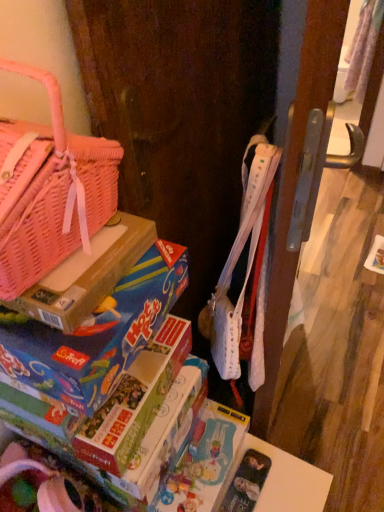
Question: From a real-world perspective, is pink woven basket at upper left over matte cardboard book at lower left?

Choices:
 (A) yes
 (B) no

Answer: (A)

Question: Is pink woven basket at upper left positioned beyond the bounds of matte cardboard book at lower left?

Choices:
 (A) no
 (B) yes

Answer: (B)

Question: Can you confirm if pink woven basket at upper left is bigger than matte cardboard book at lower left?

Choices:
 (A) yes
 (B) no

Answer: (A)

Question: Is pink woven basket at upper left further to camera compared to matte cardboard book at lower left?

Choices:
 (A) no
 (B) yes

Answer: (A)

Question: Is pink woven basket at upper left thinner than matte cardboard book at lower left?

Choices:
 (A) no
 (B) yes

Answer: (B)

Question: Is matte cardboard book at lower left situated inside pink woven basket at upper left or outside?

Choices:
 (A) outside
 (B) inside

Answer: (A)

Question: Based on their sizes in the image, would you say matte cardboard book at lower left is bigger or smaller than pink woven basket at upper left?

Choices:
 (A) big
 (B) small

Answer: (B)

Question: From the image's perspective, is matte cardboard book at lower left positioned above or below pink woven basket at upper left?

Choices:
 (A) above
 (B) below

Answer: (B)

Question: Looking at their shapes, would you say matte cardboard book at lower left is wider or thinner than pink woven basket at upper left?

Choices:
 (A) thin
 (B) wide

Answer: (B)

Question: In terms of width, does pink woven basket at upper left look wider or thinner when compared to matte cardboard book at lower left?

Choices:
 (A) wide
 (B) thin

Answer: (B)

Question: From a real-world perspective, is pink woven basket at upper left above or below matte cardboard book at lower left?

Choices:
 (A) above
 (B) below

Answer: (A)

Question: In terms of size, does pink woven basket at upper left appear bigger or smaller than matte cardboard book at lower left?

Choices:
 (A) big
 (B) small

Answer: (A)

Question: Is point (97, 138) positioned closer to the camera than point (130, 436)?

Choices:
 (A) closer
 (B) farther

Answer: (A)

Question: From a real-world perspective, is cardboard box at left positioned above or below pink woven basket at upper left?

Choices:
 (A) above
 (B) below

Answer: (B)

Question: Choose the correct answer: Is cardboard box at left inside pink woven basket at upper left or outside it?

Choices:
 (A) outside
 (B) inside

Answer: (A)